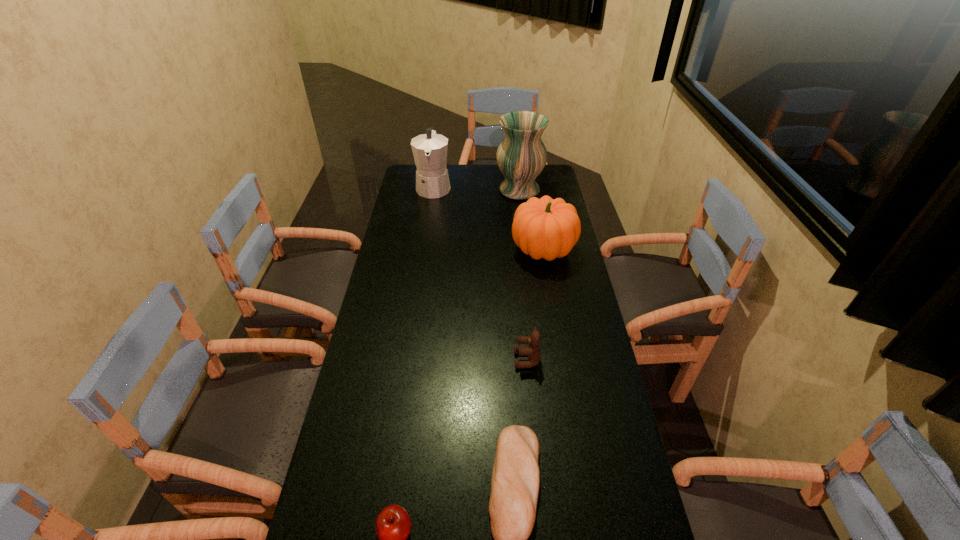
The width and height of the screenshot is (960, 540). In the image, there is a desktop. What are the coordinates of `vacant space at the right edge` in the screenshot? It's located at (575, 305).

Identify the location of vacant region at the far right corner. (559, 190).

At what (x,y) coordinates should I click in order to perform the action: click on free space between the third farthest object and the coffeepot. Please return your answer as a coordinate pair (x, y). Image resolution: width=960 pixels, height=540 pixels. Looking at the image, I should click on (489, 219).

The image size is (960, 540). Identify the location of vacant space that is in between the fourth tallest object and the pumpkin. (535, 305).

Image resolution: width=960 pixels, height=540 pixels. In order to click on object that stands as the second closest to the coffeepot in this screenshot , I will do `click(545, 228)`.

Where is `object that stands as the closest to the coffeepot`? This screenshot has height=540, width=960. object that stands as the closest to the coffeepot is located at coordinates (521, 156).

Image resolution: width=960 pixels, height=540 pixels. I want to click on free space that satisfies the following two spatial constraints: 1. on the front side of the pumpkin; 2. on the face of the fourth farthest object, so click(x=562, y=360).

This screenshot has width=960, height=540. I want to click on vacant space that satisfies the following two spatial constraints: 1. at the spout of the third farthest object; 2. on the left side of the coffeepot, so click(x=424, y=251).

You are a GUI agent. You are given a task and a screenshot of the screen. Output one action in this format:
    pyautogui.click(x=<x>, y=<y>)
    Task: Click on the free spot that satisfies the following two spatial constraints: 1. at the spout of the coffeepot; 2. on the right side of the pumpkin
    The width and height of the screenshot is (960, 540).
    Given the screenshot: What is the action you would take?
    pyautogui.click(x=424, y=251)